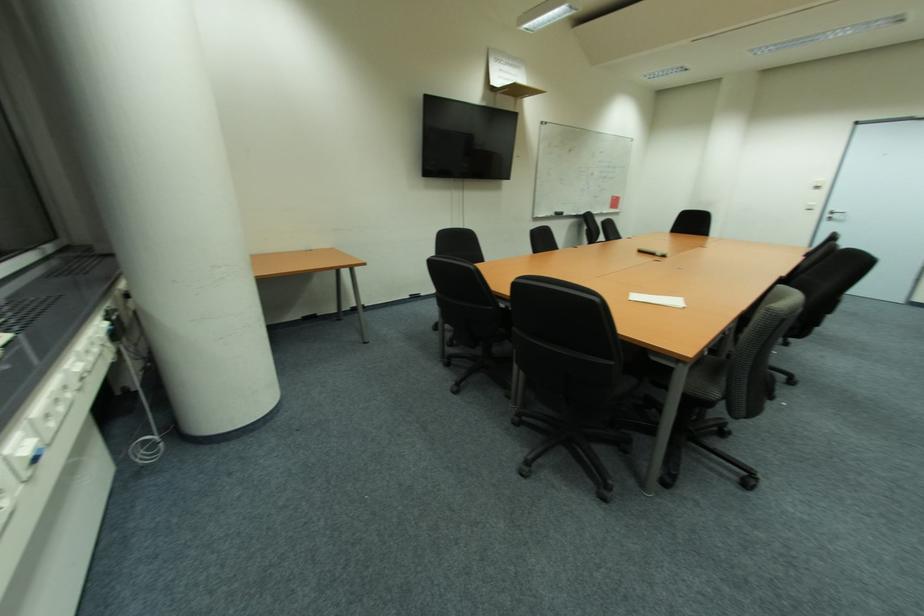
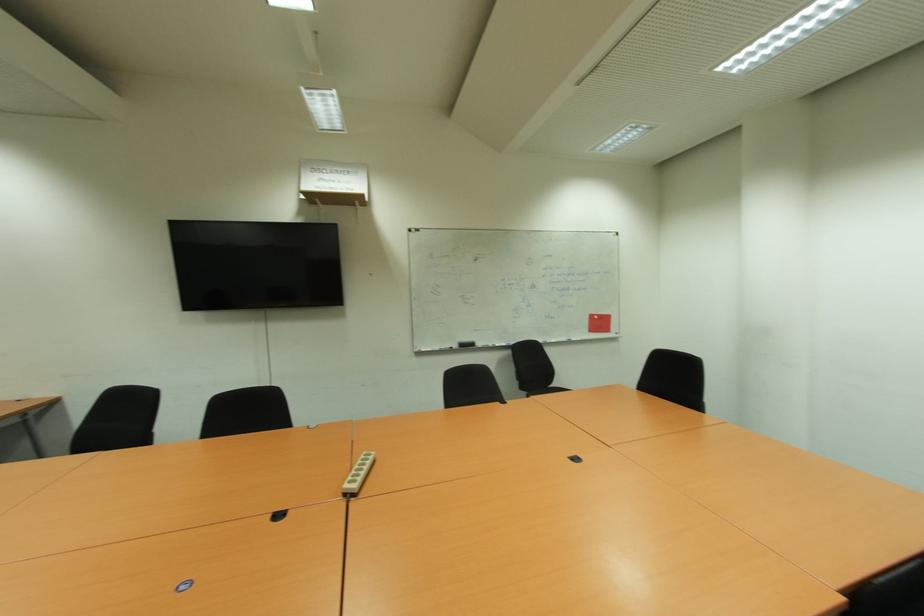
In a continuous first-person perspective shot, in which direction is the camera moving?

The cameraman moved toward right, forward.